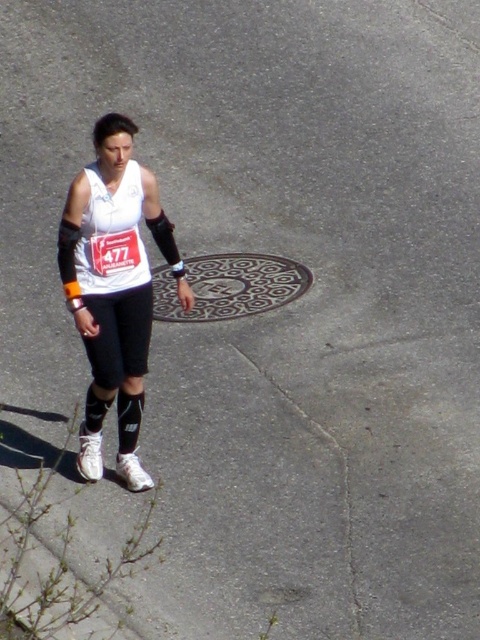
Question: Can you confirm if white matte tank top at center is smaller than patterned metal manhole cover at center?

Choices:
 (A) yes
 (B) no

Answer: (B)

Question: Which point appears closest to the camera in this image?

Choices:
 (A) (171, 278)
 (B) (145, 193)

Answer: (B)

Question: Which of the following is the farthest from the observer?

Choices:
 (A) (286, 280)
 (B) (120, 205)

Answer: (A)

Question: Does white matte tank top at center have a larger size compared to patterned metal manhole cover at center?

Choices:
 (A) yes
 (B) no

Answer: (A)

Question: Considering the relative positions of white matte tank top at center and patterned metal manhole cover at center in the image provided, where is white matte tank top at center located with respect to patterned metal manhole cover at center?

Choices:
 (A) below
 (B) above

Answer: (A)